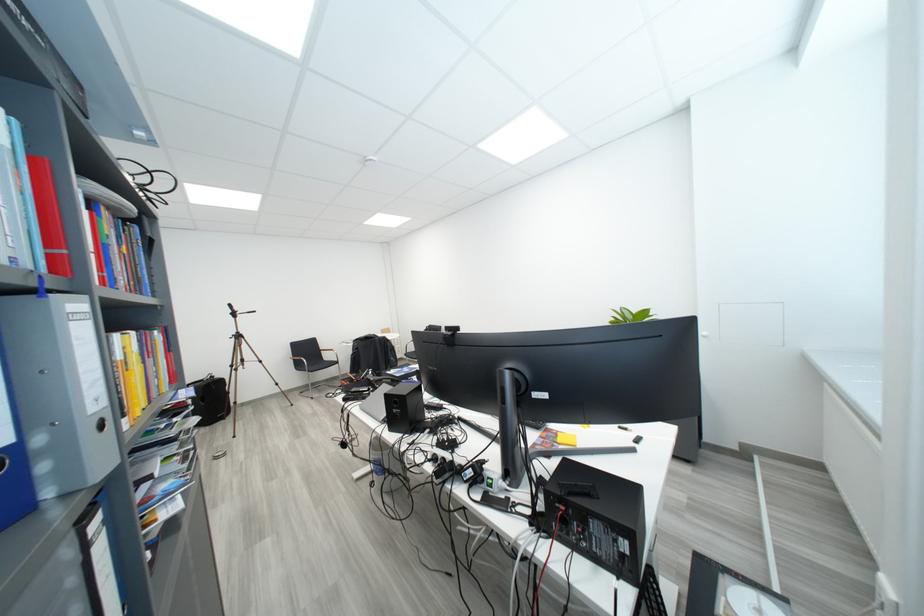
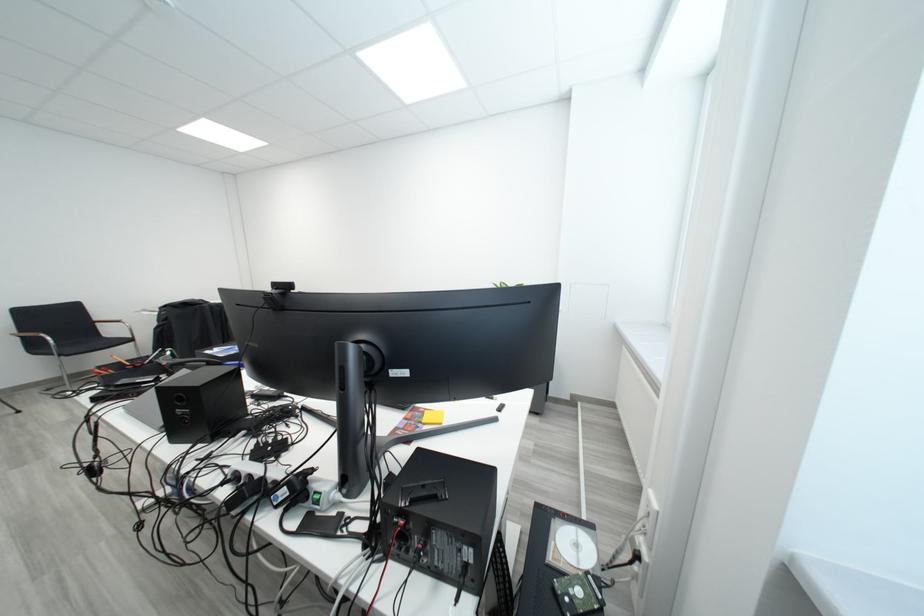
Where in the second image is the point corresponding to [633,557] from the first image?

(476, 569)